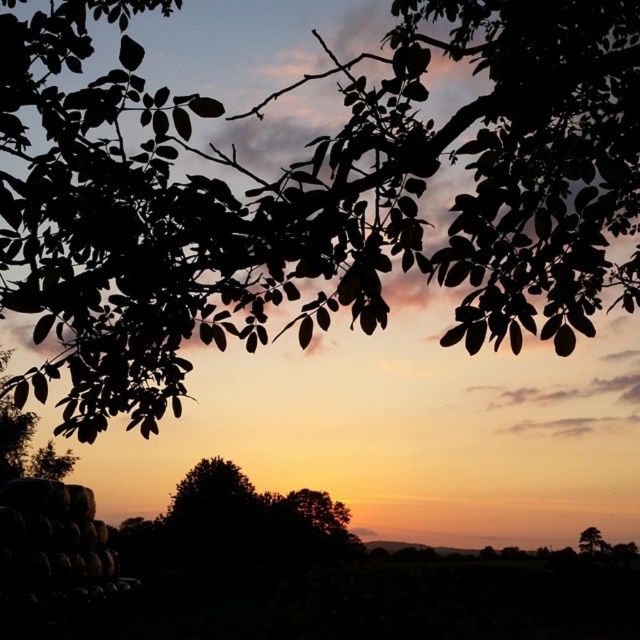
You are an artist sketching the sunset scene. You notice the black leafy branch at upper center and the green matte tree at upper right. Which one is positioned higher in the image?

The black leafy branch at upper center is positioned higher than the green matte tree at upper right in the image.

You are standing in the sunset scene and want to point to a specific location. Which object is exactly at the coordinates point (x=316, y=196)?

The black leafy branch at upper center is exactly at the coordinates point (x=316, y=196).

You are an artist painting this sunset scene. You need to decide which object to paint first based on their sizes. Which one should you start with, the black leafy branch at upper center or the green matte tree at upper right?

The black leafy branch at upper center is larger in size than the green matte tree at upper right, so you should start painting the black leafy branch at upper center first.